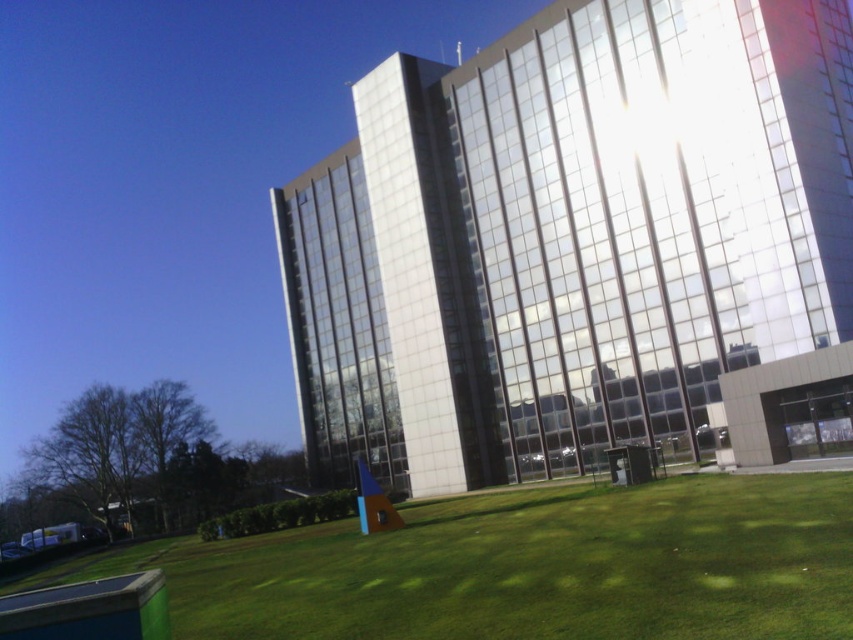
Question: Does glassy reflective building at center lie in front of green grass at lower center?

Choices:
 (A) yes
 (B) no

Answer: (B)

Question: Which of the following is the closest to the observer?

Choices:
 (A) glassy reflective building at center
 (B) green grass at lower center

Answer: (B)

Question: Is the position of glassy reflective building at center more distant than that of green grass at lower center?

Choices:
 (A) no
 (B) yes

Answer: (B)

Question: Does glassy reflective building at center appear over green grass at lower center?

Choices:
 (A) yes
 (B) no

Answer: (A)